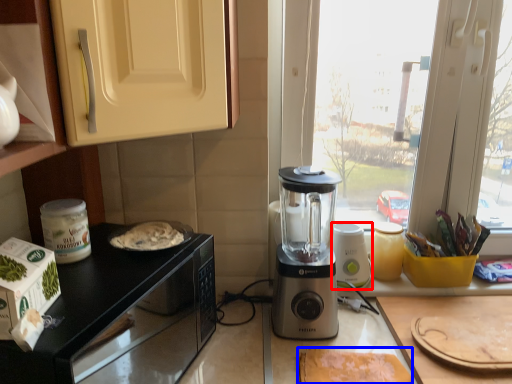
Question: Which object is further to the camera taking this photo, blender (highlighted by a red box) or food (highlighted by a blue box)?

Choices:
 (A) blender
 (B) food

Answer: (A)